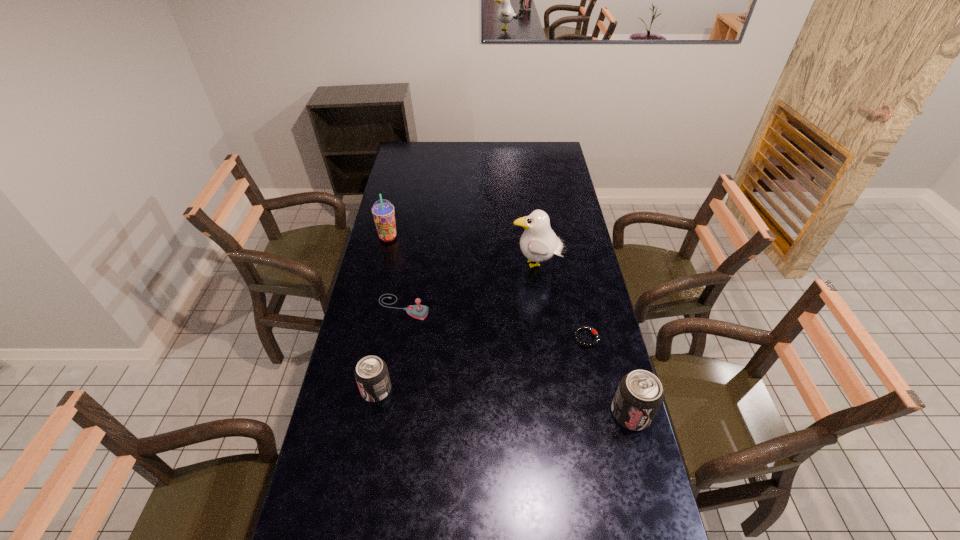
Please point a location where one more pop_(soda) can be added evenly. Please provide its 2D coordinates. Your answer should be formatted as a tuple, i.e. [(x, y)], where the tuple contains the x and y coordinates of a point satisfying the conditions above.

[(501, 402)]